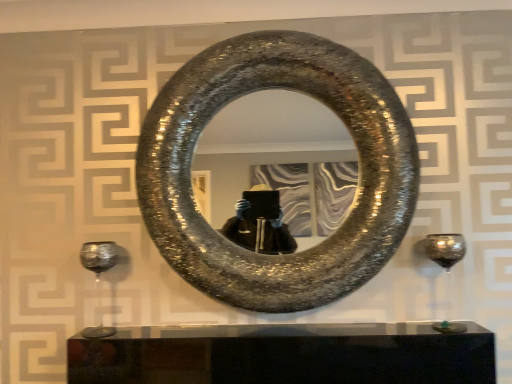
Question: Is transparent glass wine glass at right, the second wine glass positioned from the left, taller than shiny metallic horseshoe at center?

Choices:
 (A) yes
 (B) no

Answer: (B)

Question: Considering the relative positions of transparent glass wine glass at right, acting as the first wine glass starting from the right, and shiny metallic horseshoe at center in the image provided, is transparent glass wine glass at right, acting as the first wine glass starting from the right, to the left of shiny metallic horseshoe at center from the viewer's perspective?

Choices:
 (A) no
 (B) yes

Answer: (A)

Question: Considering the relative positions of transparent glass wine glass at right, acting as the first wine glass starting from the right, and shiny metallic horseshoe at center in the image provided, is transparent glass wine glass at right, acting as the first wine glass starting from the right, to the right of shiny metallic horseshoe at center from the viewer's perspective?

Choices:
 (A) no
 (B) yes

Answer: (B)

Question: Is transparent glass wine glass at right, acting as the first wine glass starting from the right, in contact with shiny metallic horseshoe at center?

Choices:
 (A) no
 (B) yes

Answer: (A)

Question: Is transparent glass wine glass at right, the second wine glass positioned from the left, wider than shiny metallic horseshoe at center?

Choices:
 (A) no
 (B) yes

Answer: (A)

Question: From the image's perspective, is transparent glass wine glass at right, acting as the first wine glass starting from the right, above shiny metallic horseshoe at center?

Choices:
 (A) no
 (B) yes

Answer: (A)

Question: From the image's perspective, is shiny metallic wine glass at lower left, which is the second wine glass from right to left, located beneath transparent glass wine glass at right, the second wine glass positioned from the left?

Choices:
 (A) no
 (B) yes

Answer: (B)

Question: Does shiny metallic wine glass at lower left, which is the second wine glass from right to left, have a greater width compared to transparent glass wine glass at right, the second wine glass positioned from the left?

Choices:
 (A) yes
 (B) no

Answer: (A)

Question: Does shiny metallic wine glass at lower left, the 1th wine glass from the left, come behind transparent glass wine glass at right, acting as the first wine glass starting from the right?

Choices:
 (A) no
 (B) yes

Answer: (B)

Question: Is shiny metallic wine glass at lower left, the 1th wine glass from the left, not inside transparent glass wine glass at right, the second wine glass positioned from the left?

Choices:
 (A) no
 (B) yes

Answer: (B)

Question: Can you confirm if shiny metallic wine glass at lower left, the 1th wine glass from the left, is smaller than transparent glass wine glass at right, acting as the first wine glass starting from the right?

Choices:
 (A) yes
 (B) no

Answer: (B)

Question: Is shiny metallic wine glass at lower left, the 1th wine glass from the left, to the right of transparent glass wine glass at right, the second wine glass positioned from the left, from the viewer's perspective?

Choices:
 (A) yes
 (B) no

Answer: (B)

Question: From a real-world perspective, is shiny metallic horseshoe at center located higher than shiny metallic wine glass at lower left, which is the second wine glass from right to left?

Choices:
 (A) yes
 (B) no

Answer: (A)